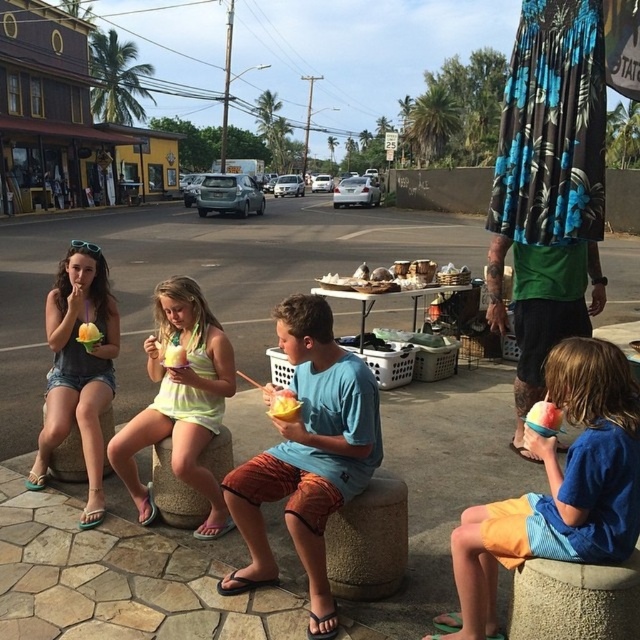
You are a customer at the market and want to buy the yellow creamy ice cream at center. The vendor is wearing a neon yellow tank top at center. Can you see the ice cream through the vendor?

The yellow creamy ice cream at center is behind the neon yellow tank top at center, so the vendor is blocking your view of the ice cream.

You are a photographer trying to capture both the floral fabric skirt at right and the yellow creamy ice cream at center in one shot. Based on their sizes, which object should you focus on first to ensure both fit in the frame?

The floral fabric skirt at right is bigger than the yellow creamy ice cream at center, so you should focus on capturing the floral fabric skirt at right first to ensure both fit in the frame.